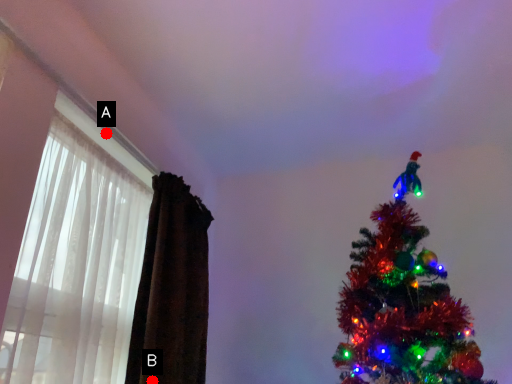
Question: Two points are circled on the image, labeled by A and B beside each circle. Among these points, which one is farthest from the camera?

Choices:
 (A) A is further
 (B) B is further

Answer: (A)